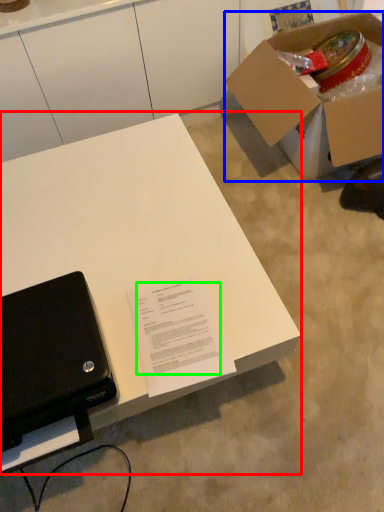
Question: Based on their relative distances, which object is nearer to desk (highlighted by a red box)? Choose from box (highlighted by a blue box) and writing (highlighted by a green box).

Choices:
 (A) box
 (B) writing

Answer: (B)